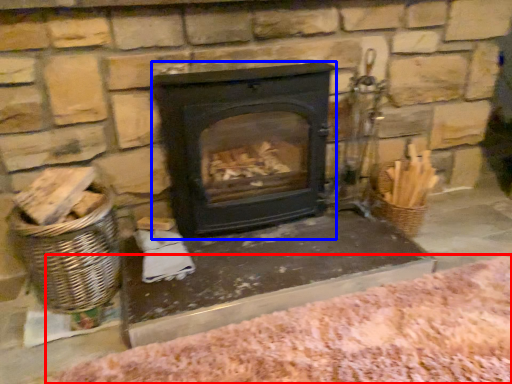
Question: Among these objects, which one is farthest to the camera, blanket (highlighted by a red box) or wood burning stove (highlighted by a blue box)?

Choices:
 (A) blanket
 (B) wood burning stove

Answer: (B)